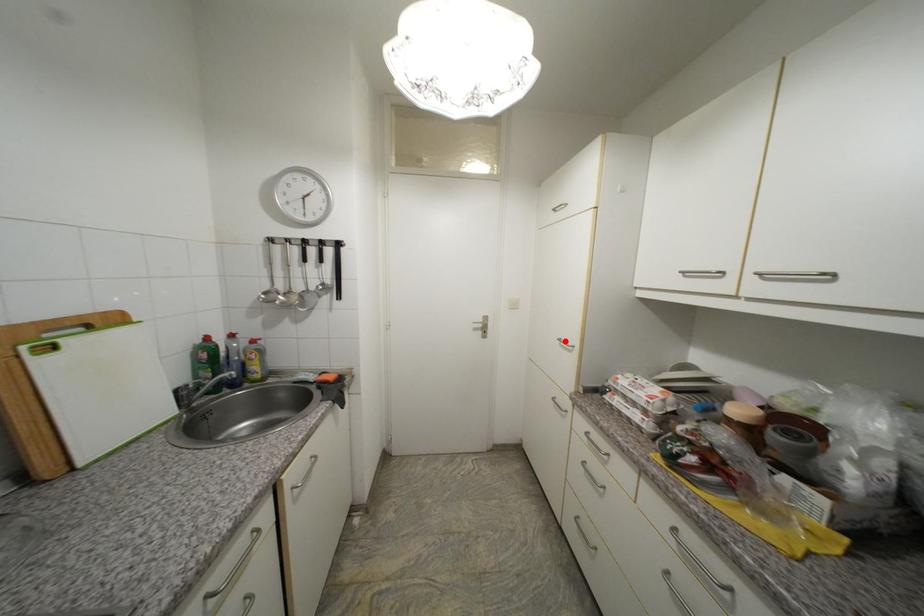
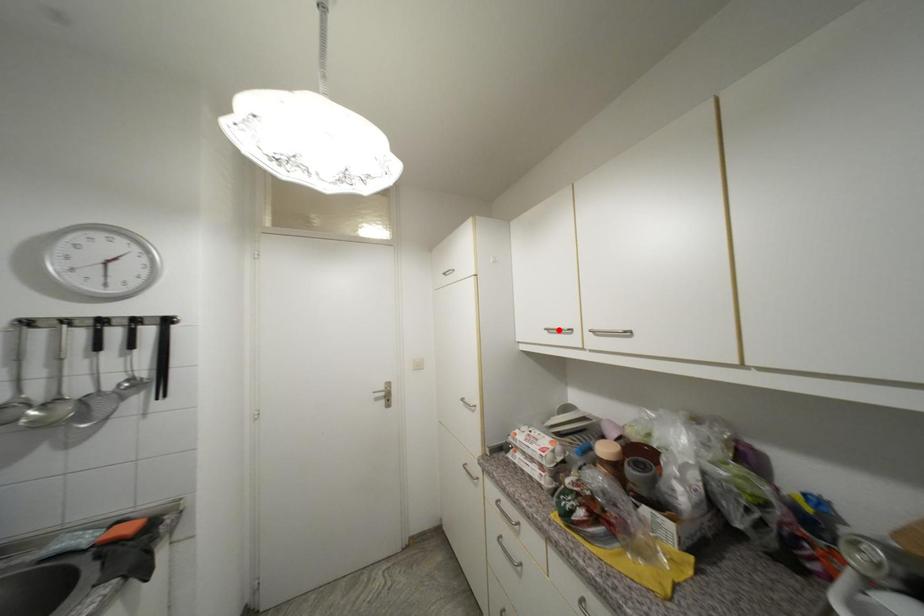
I am providing you with two images of the same scene from different viewpoints. A red point is marked on the first image and another point is marked on the second image. Is the marked point in image1 the same physical position as the marked point in image2?

No